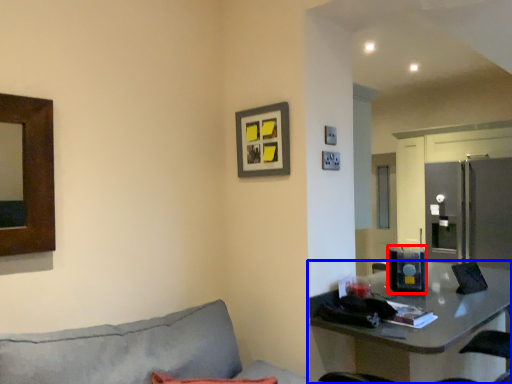
Question: Among these objects, which one is nearest to the camera, appliance (highlighted by a red box) or table (highlighted by a blue box)?

Choices:
 (A) appliance
 (B) table

Answer: (B)